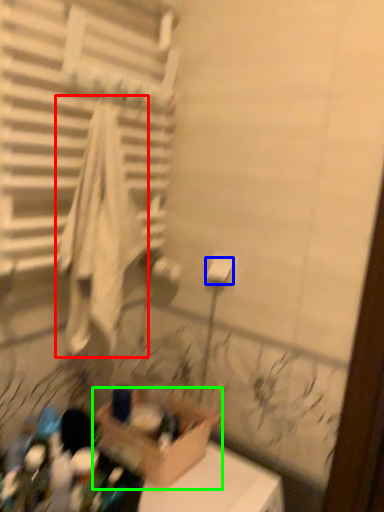
Question: Based on their relative distances, which object is farther from bath towel (highlighted by a red box)? Choose from toilet paper (highlighted by a blue box) and cardboard box (highlighted by a green box).

Choices:
 (A) toilet paper
 (B) cardboard box

Answer: (B)